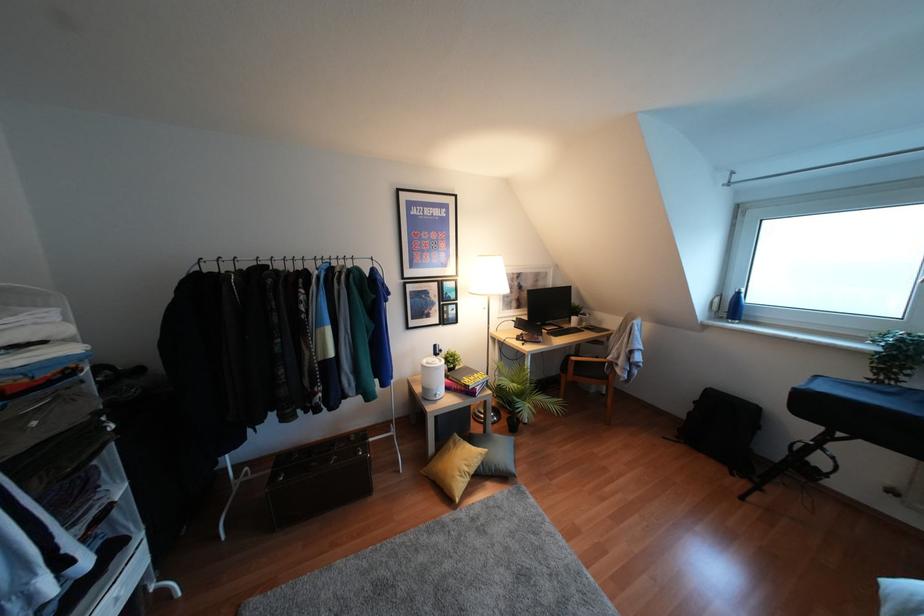
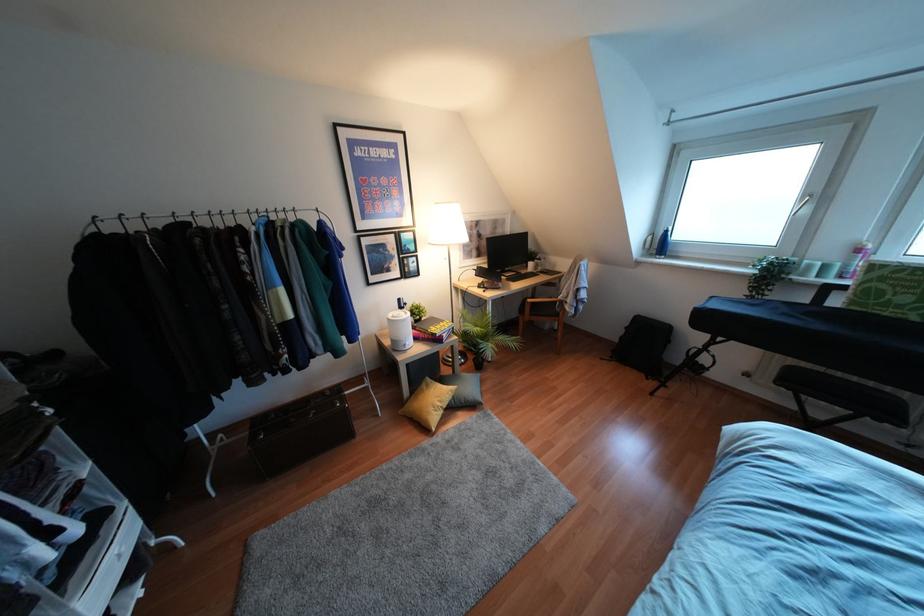
In the second image, find the point that corresponds to point 475,374 in the first image.

(441, 323)